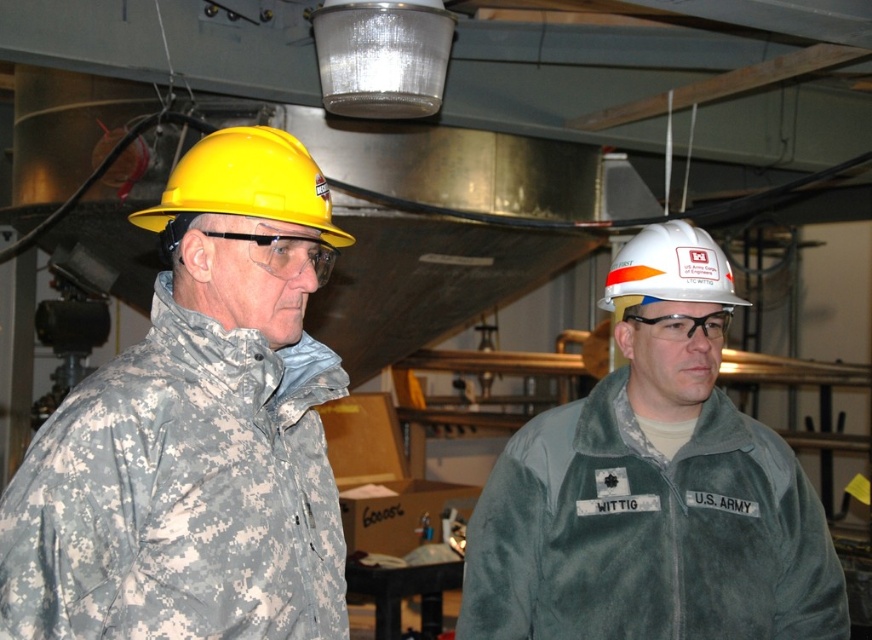
Question: Is camouflage jacket at left to the left of white matte hard hat at center from the viewer's perspective?

Choices:
 (A) yes
 (B) no

Answer: (A)

Question: Is white matte hard hat at center to the right of yellow hard hat at left from the viewer's perspective?

Choices:
 (A) no
 (B) yes

Answer: (B)

Question: Which point appears closest to the camera in this image?

Choices:
 (A) (690, 515)
 (B) (648, 241)

Answer: (A)

Question: Which point appears farthest from the camera in this image?

Choices:
 (A) (324, 189)
 (B) (528, 465)

Answer: (B)

Question: Which point is farther to the camera?

Choices:
 (A) white matte helmet at center
 (B) yellow hard hat at left
 (C) white matte hard hat at center
 (D) camouflage jacket at left

Answer: (A)

Question: From the image, what is the correct spatial relationship of white matte hard hat at center in relation to yellow hard hat at left?

Choices:
 (A) left
 (B) right

Answer: (B)